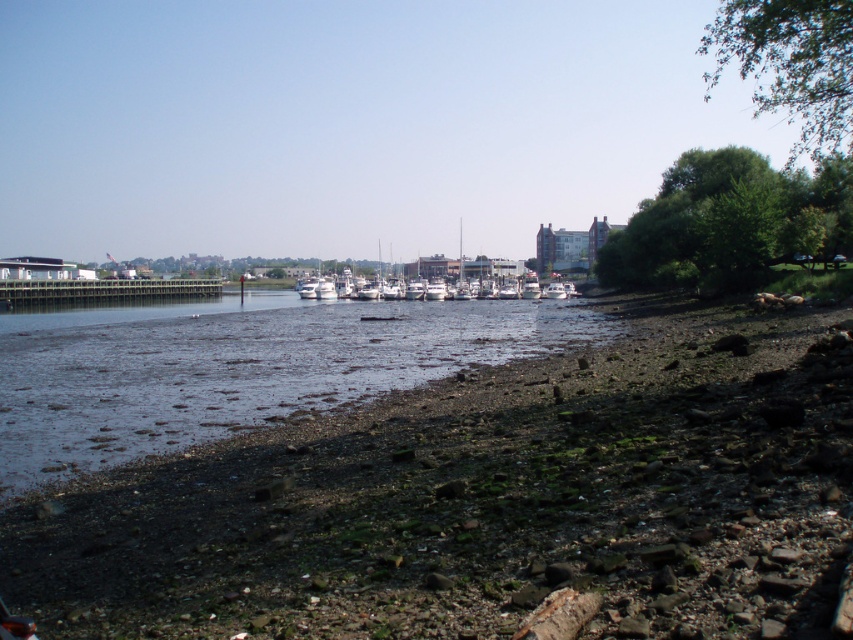
You are standing on the shore of the waterfront scene and want to reach the white glossy boat at center. Which direction should you move to get there from the brown gravel river at center?

The brown gravel river at center is below the white glossy boat at center, so you should move upward from the brown gravel river at center to reach the white glossy boat at center.